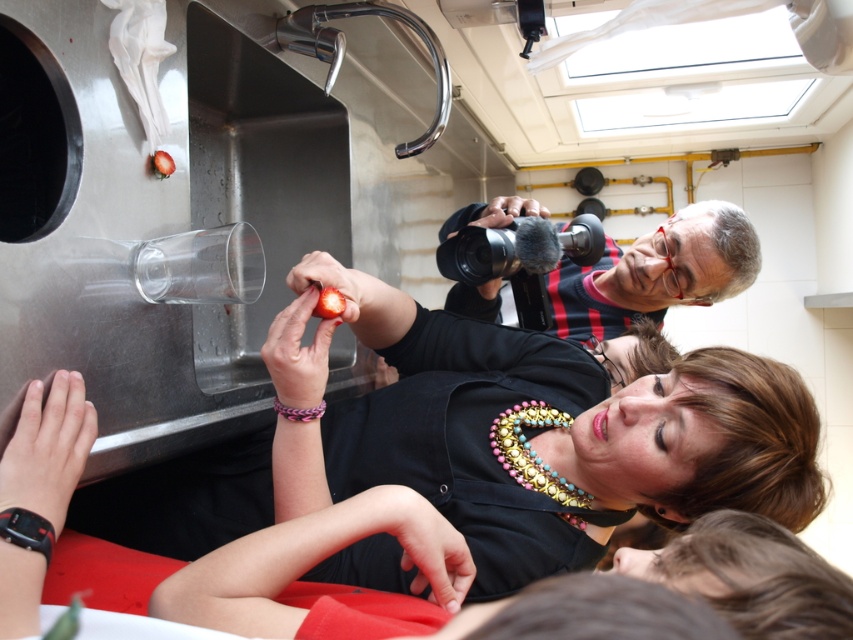
Question: Which point is closer to the camera taking this photo?

Choices:
 (A) (407, 371)
 (B) (4, 532)

Answer: (B)

Question: Estimate the real-world distances between objects in this image. Which object is closer to the matte black shirt at center?

Choices:
 (A) black rubber bracelet at lower left
 (B) pink woven bracelet at center

Answer: (B)

Question: Which point is farther from the camera taking this photo?

Choices:
 (A) (33, 529)
 (B) (456, 316)
 (C) (318, 410)
 (D) (642, 312)

Answer: (D)

Question: Where is matte black shirt at center located in relation to matte black camera at upper right in the image?

Choices:
 (A) below
 (B) above

Answer: (A)

Question: Can you confirm if matte black shirt at center is thinner than black rubber bracelet at lower left?

Choices:
 (A) no
 (B) yes

Answer: (A)

Question: Can you confirm if matte black camera at upper right is positioned above pink woven bracelet at center?

Choices:
 (A) yes
 (B) no

Answer: (A)